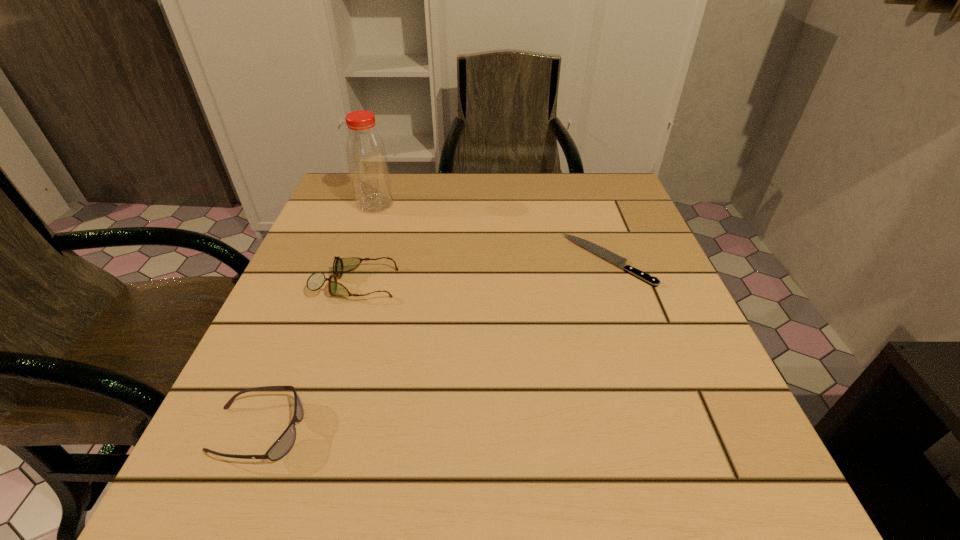
The width and height of the screenshot is (960, 540). In order to click on object located in the far edge section of the desktop in this screenshot , I will do `click(366, 155)`.

The width and height of the screenshot is (960, 540). In order to click on object located at the near edge in this screenshot , I will do `click(281, 447)`.

Where is `bottle present at the left edge`? bottle present at the left edge is located at coordinates (366, 155).

Identify the location of spectacles located in the left edge section of the desktop. (316, 280).

You are a GUI agent. You are given a task and a screenshot of the screen. Output one action in this format:
    pyautogui.click(x=<x>, y=<y>)
    Task: Click on the sunglasses present at the left edge
    
    Given the screenshot: What is the action you would take?
    pyautogui.click(x=281, y=447)

I want to click on object present at the right edge, so click(606, 254).

You are a GUI agent. You are given a task and a screenshot of the screen. Output one action in this format:
    pyautogui.click(x=<x>, y=<y>)
    Task: Click on the object situated at the far left corner
    Image resolution: width=960 pixels, height=540 pixels.
    Given the screenshot: What is the action you would take?
    pyautogui.click(x=366, y=155)

Identify the location of object present at the near left corner. The width and height of the screenshot is (960, 540). (281, 447).

Locate an element on the screen. vacant space at the far edge is located at coordinates (558, 198).

At what (x,y) coordinates should I click in order to perform the action: click on vacant area at the near edge of the desktop. Please return your answer as a coordinate pair (x, y). This screenshot has height=540, width=960. Looking at the image, I should click on (334, 452).